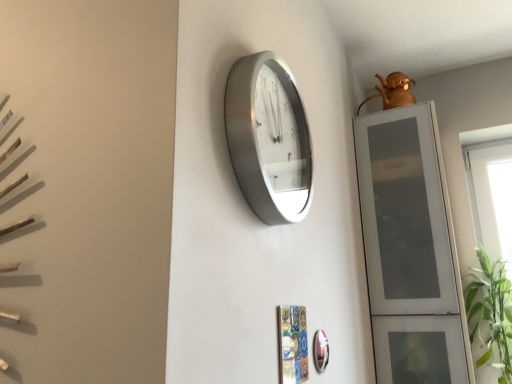
Question: Are transparent glass window at right and satin silver clock at center far apart?

Choices:
 (A) no
 (B) yes

Answer: (B)

Question: From the image's perspective, is transparent glass window at right on satin silver clock at center?

Choices:
 (A) no
 (B) yes

Answer: (A)

Question: Can we say transparent glass window at right lies outside satin silver clock at center?

Choices:
 (A) no
 (B) yes

Answer: (B)

Question: Can you confirm if transparent glass window at right is thinner than satin silver clock at center?

Choices:
 (A) yes
 (B) no

Answer: (B)

Question: Is transparent glass window at right surrounding satin silver clock at center?

Choices:
 (A) no
 (B) yes

Answer: (A)

Question: Can you confirm if transparent glass window at right is positioned to the left of satin silver clock at center?

Choices:
 (A) no
 (B) yes

Answer: (A)

Question: From the image's perspective, is transparent glass cabinet at right beneath transparent glass window at right?

Choices:
 (A) no
 (B) yes

Answer: (A)

Question: Does transparent glass cabinet at right have a greater width compared to transparent glass window at right?

Choices:
 (A) no
 (B) yes

Answer: (B)

Question: Is transparent glass cabinet at right behind transparent glass window at right?

Choices:
 (A) yes
 (B) no

Answer: (B)

Question: Is transparent glass window at right inside transparent glass cabinet at right?

Choices:
 (A) no
 (B) yes

Answer: (A)

Question: Is transparent glass cabinet at right looking in the opposite direction of transparent glass window at right?

Choices:
 (A) yes
 (B) no

Answer: (B)

Question: Does transparent glass cabinet at right have a lesser height compared to transparent glass window at right?

Choices:
 (A) no
 (B) yes

Answer: (B)

Question: Does transparent glass window at right turn towards shiny silver mirror at lower center?

Choices:
 (A) yes
 (B) no

Answer: (B)